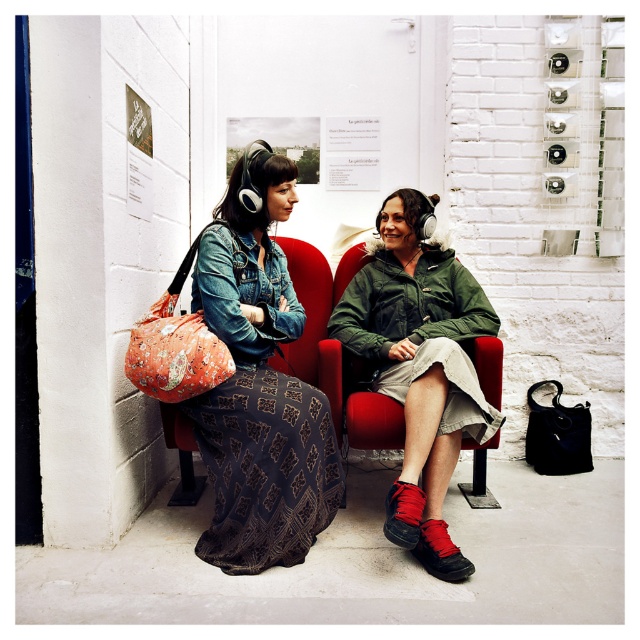
Question: Which point is farther to the camera?

Choices:
 (A) (413, 484)
 (B) (317, 486)

Answer: (B)

Question: Does denim jacket at left lie in front of green matte jacket at center?

Choices:
 (A) no
 (B) yes

Answer: (A)

Question: Does denim jacket at left have a lesser width compared to green matte jacket at center?

Choices:
 (A) no
 (B) yes

Answer: (B)

Question: Which point appears farthest from the camera in this image?

Choices:
 (A) (452, 253)
 (B) (243, 189)

Answer: (A)

Question: Is denim jacket at left bigger than green matte jacket at center?

Choices:
 (A) no
 (B) yes

Answer: (A)